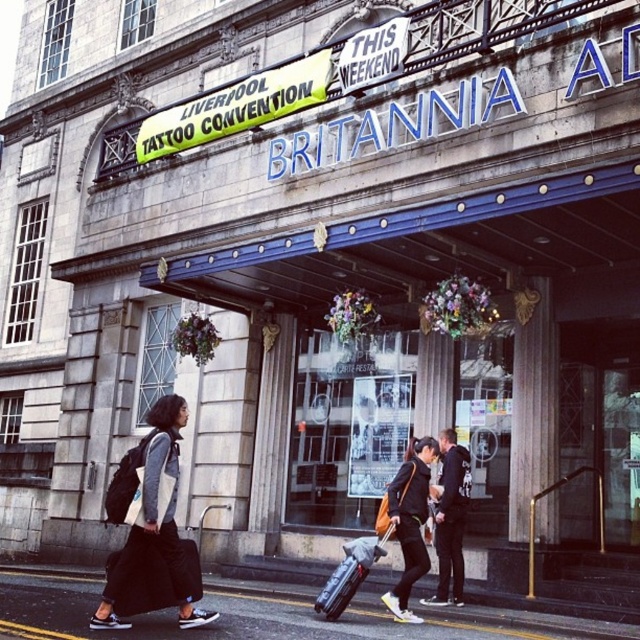
You are standing at the entrance of the Britannia building and want to place a small potted plant on the smooth asphalt pavement at lower center. However, there is a dark gray jacket at center in the way. Which object is nearer to you so that you can move it first?

The smooth asphalt pavement at lower center is closer to the viewer than the dark gray jacket at center, so you should move the dark gray jacket at center first to access the pavement.

You are a security guard at the Liverpool Tattoo Convention. You need to check all bags before entry. Which bag should you check first, the matte black backpack at left or the matte black suitcase at center, if the larger one requires more thorough inspection?

The matte black backpack at left is larger than the matte black suitcase at center, so you should check the matte black backpack at left first for a more thorough inspection.